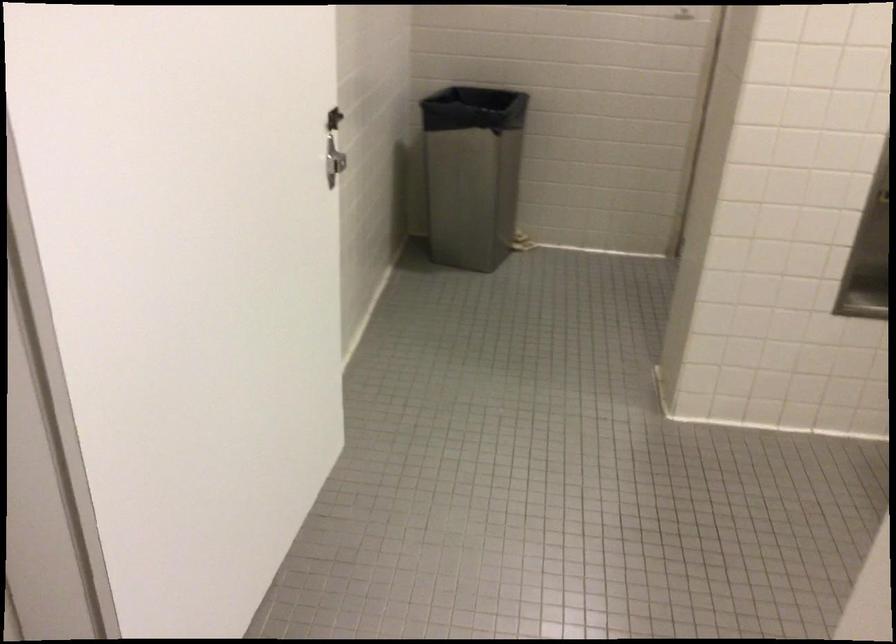
Describe the element at coordinates (332, 152) in the screenshot. I see `the stall door latch` at that location.